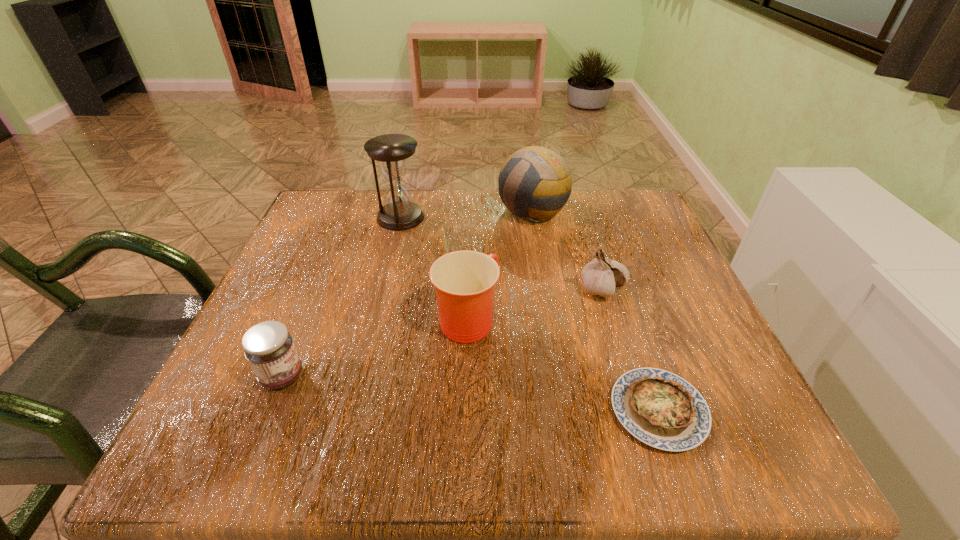
In order to click on free space between the fifth object from right to left and the volleyball in this screenshot , I will do `click(467, 214)`.

Where is `free point between the jam and the garlic`? This screenshot has width=960, height=540. free point between the jam and the garlic is located at coordinates (443, 333).

The image size is (960, 540). I want to click on free space between the volleyball and the shortest object, so click(x=595, y=310).

Identify the location of free space between the volleyball and the fifth object from right to left. The height and width of the screenshot is (540, 960). (467, 214).

Locate an element on the screen. This screenshot has width=960, height=540. free space between the volleyball and the fifth object from right to left is located at coordinates (467, 214).

The image size is (960, 540). Identify the location of empty space between the leftmost object and the fifth object from right to left. (342, 296).

Find the location of a particular element. The height and width of the screenshot is (540, 960). the closest object relative to the hourglass is located at coordinates (539, 178).

You are a GUI agent. You are given a task and a screenshot of the screen. Output one action in this format:
    pyautogui.click(x=<x>, y=<y>)
    Task: Click on the object identified as the closest to the garlic
    Image resolution: width=960 pixels, height=540 pixels.
    Given the screenshot: What is the action you would take?
    pyautogui.click(x=661, y=409)

You are a GUI agent. You are given a task and a screenshot of the screen. Output one action in this format:
    pyautogui.click(x=<x>, y=<y>)
    Task: Click on the vacant area that satisfies the following two spatial constraints: 1. on the front side of the quiche; 2. on the left side of the volleyball
    The height and width of the screenshot is (540, 960).
    Given the screenshot: What is the action you would take?
    pyautogui.click(x=565, y=410)